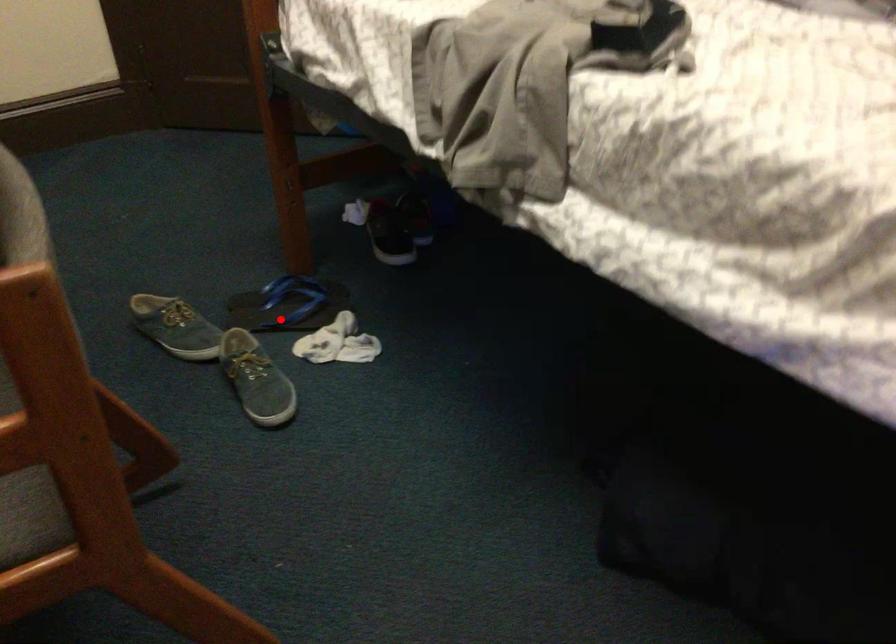
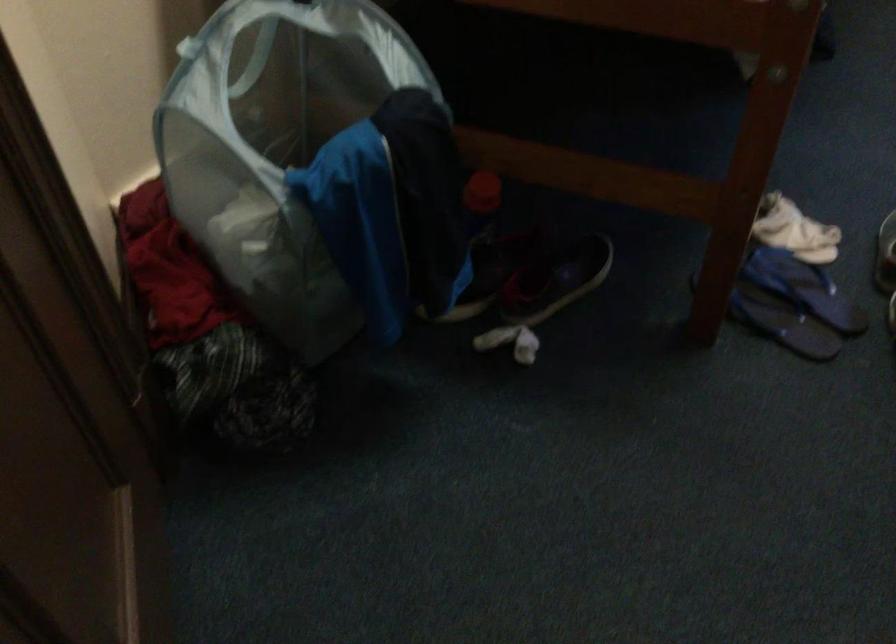
Find the pixel in the second image that matches the highlighted location in the first image.

(804, 288)